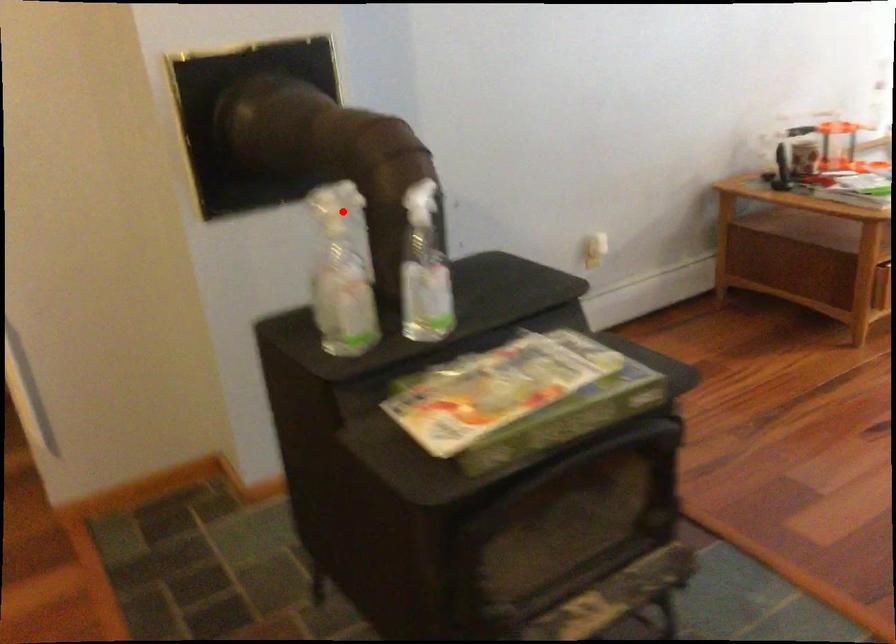
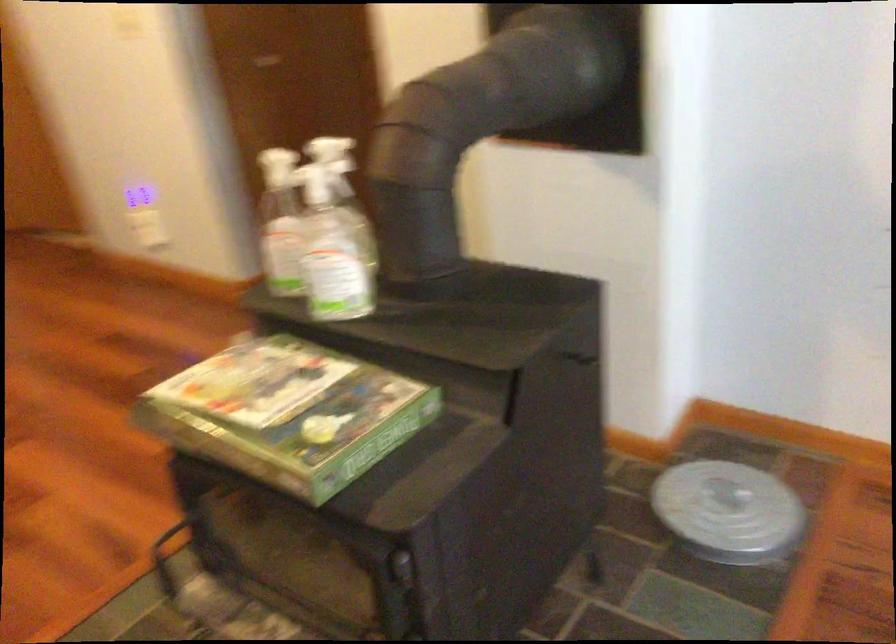
Find the pixel in the second image that matches the highlighted location in the first image.

(278, 167)